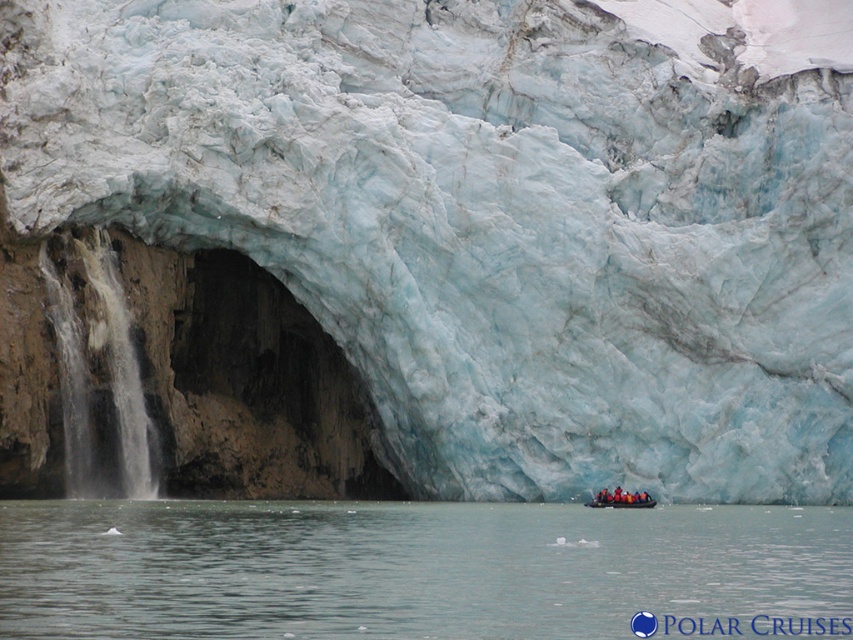
In the scene shown: Is clear water at lower center positioned in front of white frothy water at left?

Yes, it is in front of white frothy water at left.

Does clear water at lower center have a smaller size compared to white frothy water at left?

Actually, clear water at lower center might be larger than white frothy water at left.

Does point (746, 625) come in front of point (114, 284)?

Yes, point (746, 625) is closer to viewer.

At what (x,y) coordinates should I click in order to perform the action: click on clear water at lower center. Please return your answer as a coordinate pair (x, y). The image size is (853, 640). Looking at the image, I should click on (415, 570).

Is white frothy water at left smaller than rubberized yellow boat at lower center?

No.

Does white frothy water at left have a lesser height compared to rubberized yellow boat at lower center?

No, white frothy water at left is not shorter than rubberized yellow boat at lower center.

In order to click on white frothy water at left in this screenshot , I will do `click(90, 369)`.

Can you confirm if clear water at lower center is taller than rubberized yellow boat at lower center?

Yes, clear water at lower center is taller than rubberized yellow boat at lower center.

Who is more forward, (432,515) or (608,500)?

Point (432,515) is more forward.

Find the location of a particular element. clear water at lower center is located at coordinates (415, 570).